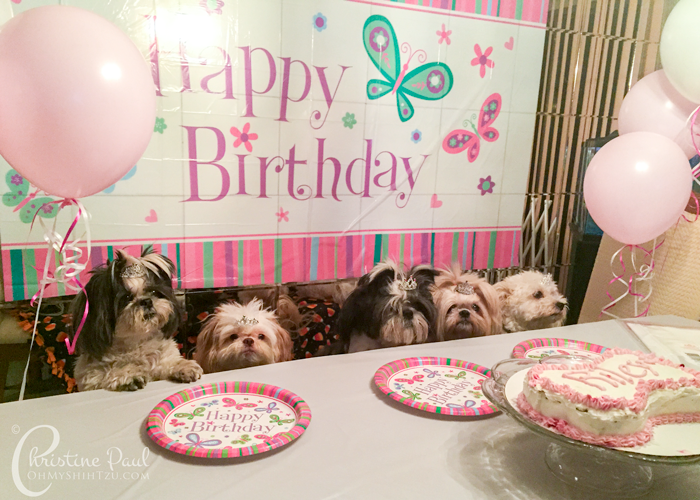
The height and width of the screenshot is (500, 700). I want to click on pink letters on top of birthday cake, so click(584, 381), click(609, 375), click(643, 367).